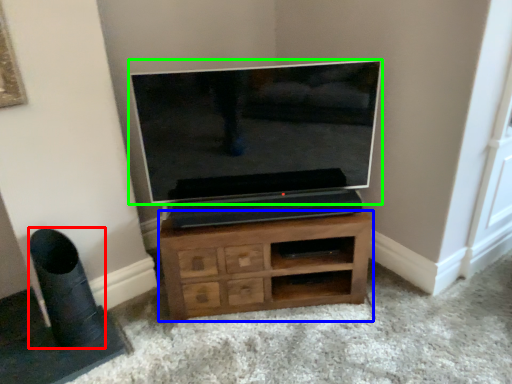
Question: Which object is the closest to the speaker (highlighted by a red box)? Choose among these: chest of drawers (highlighted by a blue box) or television (highlighted by a green box).

Choices:
 (A) chest of drawers
 (B) television

Answer: (A)